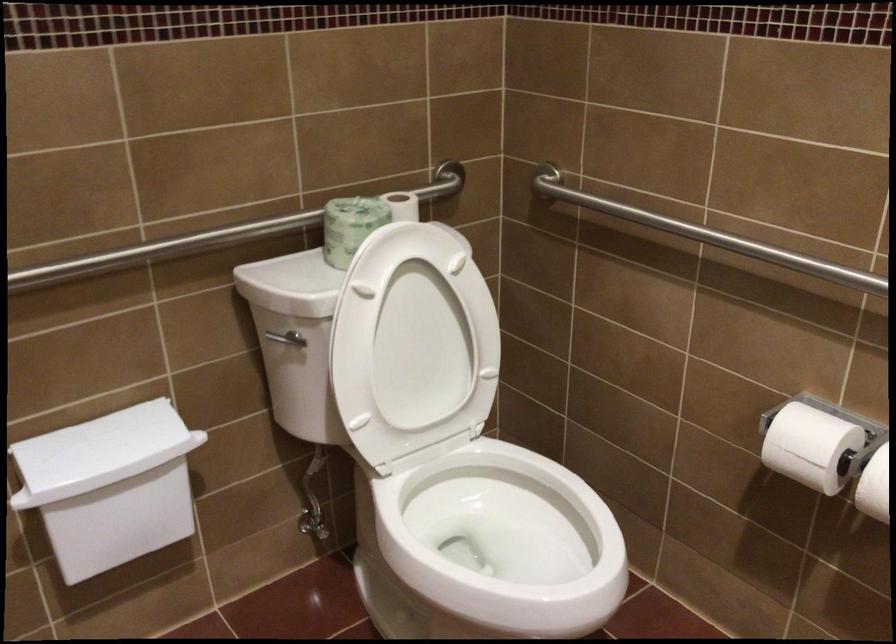
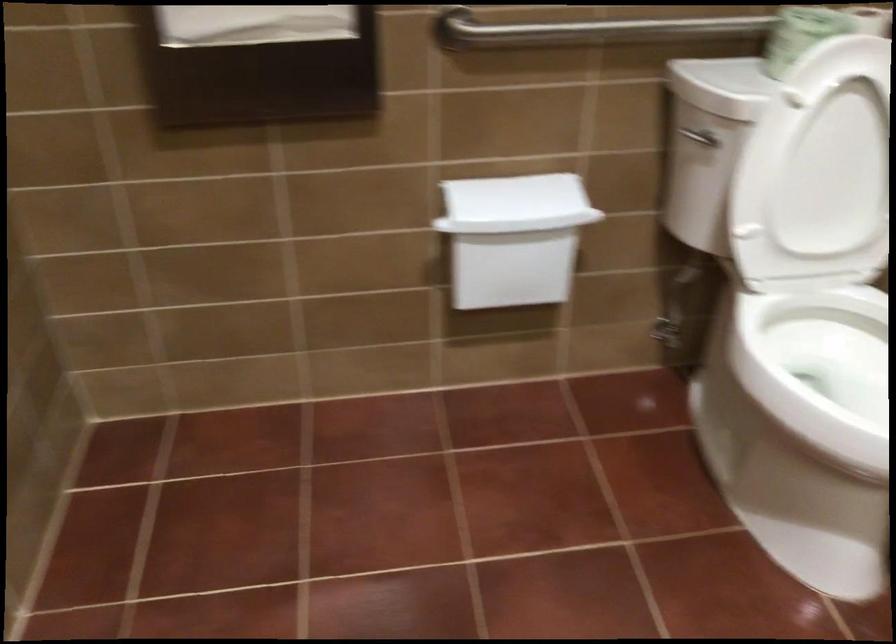
Find the pixel in the second image that matches the point at 464,526 in the first image.

(819, 368)